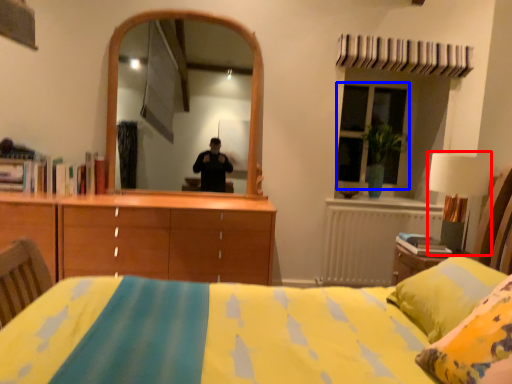
Question: Which object appears closest to the camera in this image, table lamp (highlighted by a red box) or window (highlighted by a blue box)?

Choices:
 (A) table lamp
 (B) window

Answer: (A)